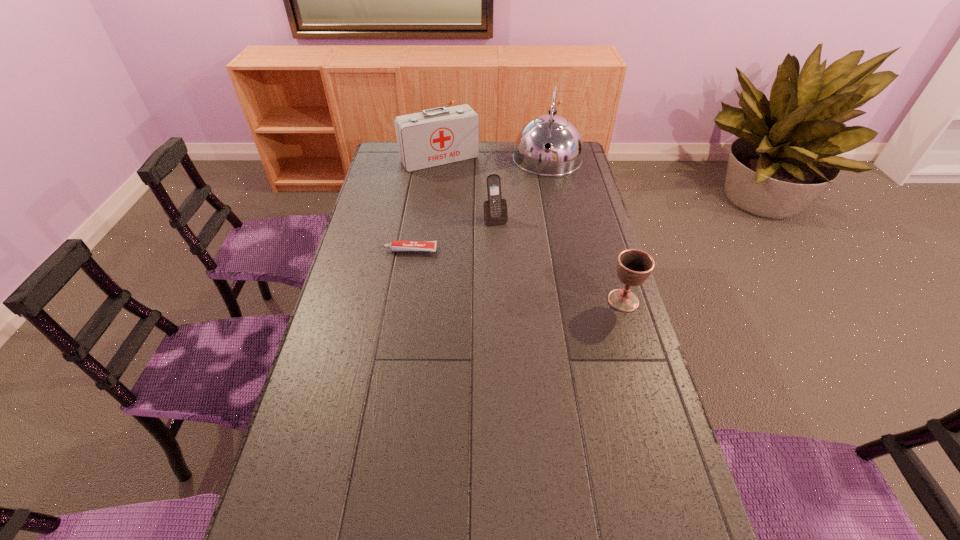
Locate an element on the screen. toothpaste is located at coordinates (396, 246).

Image resolution: width=960 pixels, height=540 pixels. I want to click on the shortest object, so click(x=396, y=246).

Image resolution: width=960 pixels, height=540 pixels. What are the coordinates of `the nearest object` in the screenshot? It's located at (634, 267).

Find the location of `the fourth shortest object`. the fourth shortest object is located at coordinates (438, 136).

Identify the location of cellular telephone. Image resolution: width=960 pixels, height=540 pixels. (495, 208).

Where is `the third object from left to right`? The height and width of the screenshot is (540, 960). the third object from left to right is located at coordinates (495, 208).

At what (x,y) coordinates should I click in order to perform the action: click on kettle. Please return your answer as a coordinate pair (x, y). This screenshot has height=540, width=960. Looking at the image, I should click on (564, 155).

Image resolution: width=960 pixels, height=540 pixels. Find the location of `vacant region located at the nozzle of the shortest object`. vacant region located at the nozzle of the shortest object is located at coordinates (365, 250).

The height and width of the screenshot is (540, 960). I want to click on free space located on the left of the nearest object, so tap(487, 300).

Identify the location of free space located 0.100m on the front-facing side of the first-aid kit. (462, 184).